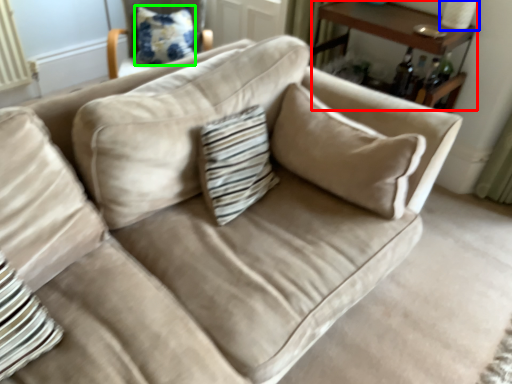
Question: Based on their relative distances, which object is nearer to table (highlighted by a red box)? Choose from table lamp (highlighted by a blue box) and pillow (highlighted by a green box).

Choices:
 (A) table lamp
 (B) pillow

Answer: (A)